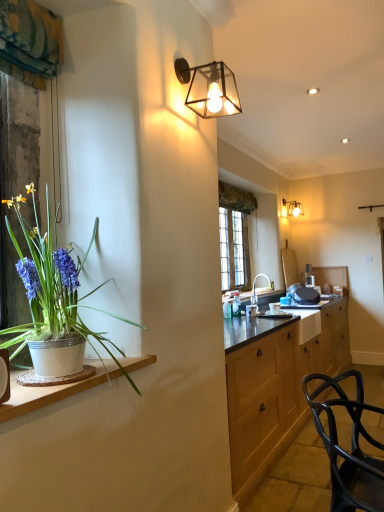
Question: Considering the relative sizes of matte glass lamp at upper center, the 2th lamp viewed from the right, and white ceramic sink at center in the image provided, is matte glass lamp at upper center, the 2th lamp viewed from the right, taller than white ceramic sink at center?

Choices:
 (A) no
 (B) yes

Answer: (A)

Question: Is matte glass lamp at upper center, the 1th lamp from the left, to the right of white ceramic sink at center from the viewer's perspective?

Choices:
 (A) no
 (B) yes

Answer: (A)

Question: Is matte glass lamp at upper center, the 2th lamp viewed from the right, positioned with its back to white ceramic sink at center?

Choices:
 (A) no
 (B) yes

Answer: (A)

Question: Does matte glass lamp at upper center, the 1th lamp from the left, come behind white ceramic sink at center?

Choices:
 (A) no
 (B) yes

Answer: (A)

Question: Can you confirm if matte glass lamp at upper center, placed as the 2th lamp when sorted from back to front, is thinner than white ceramic sink at center?

Choices:
 (A) no
 (B) yes

Answer: (B)

Question: Is matte glass lamp at upper center, placed as the 1th lamp when sorted from front to back, oriented towards white ceramic sink at center?

Choices:
 (A) yes
 (B) no

Answer: (B)

Question: Does white ceramic pot at left have a greater height compared to white ceramic sink at center?

Choices:
 (A) yes
 (B) no

Answer: (B)

Question: From the image's perspective, does white ceramic pot at left appear higher than white ceramic sink at center?

Choices:
 (A) no
 (B) yes

Answer: (A)

Question: Does white ceramic pot at left appear on the left side of white ceramic sink at center?

Choices:
 (A) no
 (B) yes

Answer: (B)

Question: Is white ceramic pot at left further to the viewer compared to white ceramic sink at center?

Choices:
 (A) yes
 (B) no

Answer: (B)

Question: Is white ceramic pot at left directly adjacent to white ceramic sink at center?

Choices:
 (A) no
 (B) yes

Answer: (A)

Question: Does white ceramic pot at left have a lesser width compared to white ceramic sink at center?

Choices:
 (A) yes
 (B) no

Answer: (B)

Question: Does matte glass wall sconce at upper right, placed as the 1th lamp when sorted from back to front, have a smaller size compared to white ceramic pot at left?

Choices:
 (A) yes
 (B) no

Answer: (B)